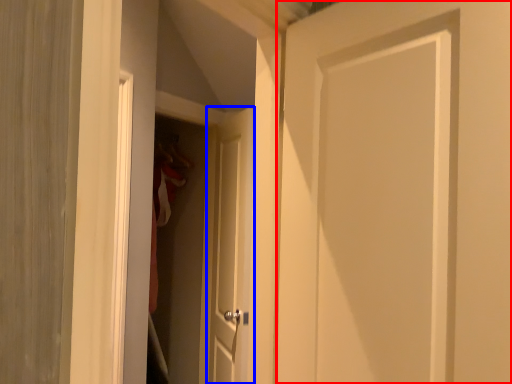
Question: Which object is closer to the camera taking this photo, door (highlighted by a red box) or door (highlighted by a blue box)?

Choices:
 (A) door
 (B) door

Answer: (A)